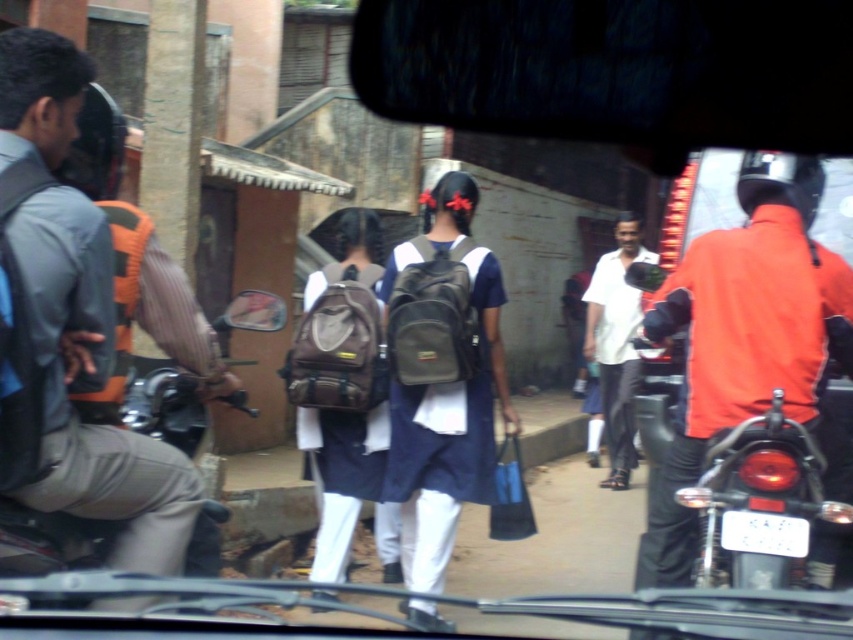
Does orange fabric helmet at right appear on the right side of matte gray backpack at center?

Correct, you'll find orange fabric helmet at right to the right of matte gray backpack at center.

Is orange fabric helmet at right bigger than matte gray backpack at center?

Correct, orange fabric helmet at right is larger in size than matte gray backpack at center.

This screenshot has height=640, width=853. What do you see at coordinates (747, 342) in the screenshot?
I see `orange fabric helmet at right` at bounding box center [747, 342].

Identify the location of orange fabric helmet at right. Image resolution: width=853 pixels, height=640 pixels. (747, 342).

Which is more to the right, gray fabric backpack at left or matte gray backpack at center?

From the viewer's perspective, matte gray backpack at center appears more on the right side.

Does gray fabric backpack at left come in front of matte gray backpack at center?

Yes.

Is point (44, 240) more distant than point (392, 488)?

No, (44, 240) is closer to viewer.

This screenshot has width=853, height=640. Identify the location of gray fabric backpack at left. (91, 387).

Between point (489, 358) and point (630, 333), which one is positioned in front?

Point (489, 358) is in front.

Is matte gray backpack at center above white matte shirt at center?

Incorrect, matte gray backpack at center is not positioned above white matte shirt at center.

At what (x,y) coordinates should I click in order to perform the action: click on matte gray backpack at center. Please return your answer as a coordinate pair (x, y). The height and width of the screenshot is (640, 853). Looking at the image, I should click on (442, 378).

Identify the location of matte gray backpack at center. (442, 378).